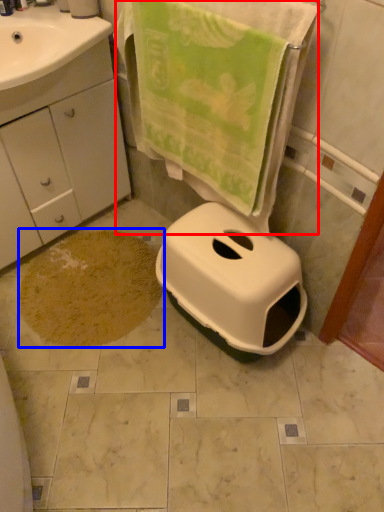
Question: Which object is closer to the camera taking this photo, beach towel (highlighted by a red box) or bath mat (highlighted by a blue box)?

Choices:
 (A) beach towel
 (B) bath mat

Answer: (A)